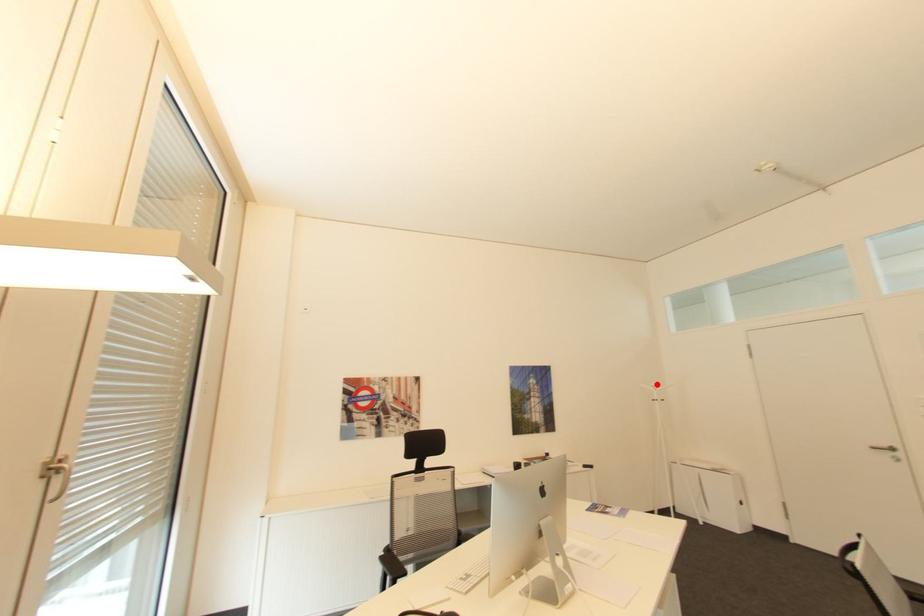
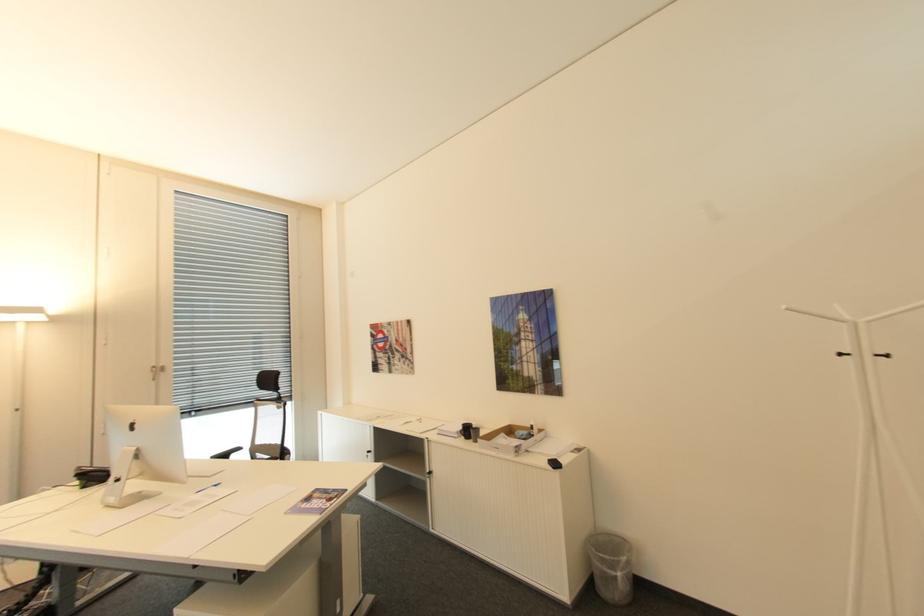
Where in the second image is the point corresponding to the highlighted location from the first image?

(791, 307)